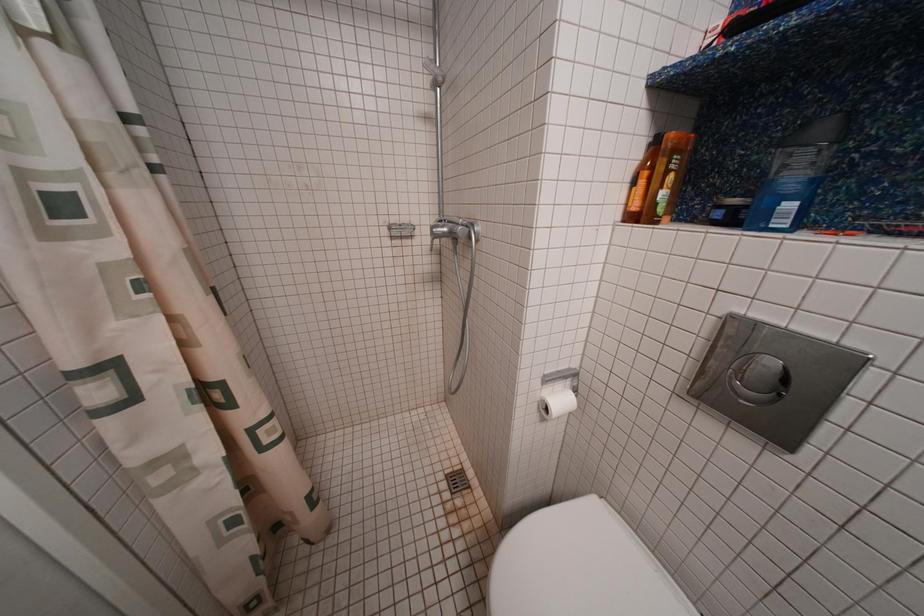
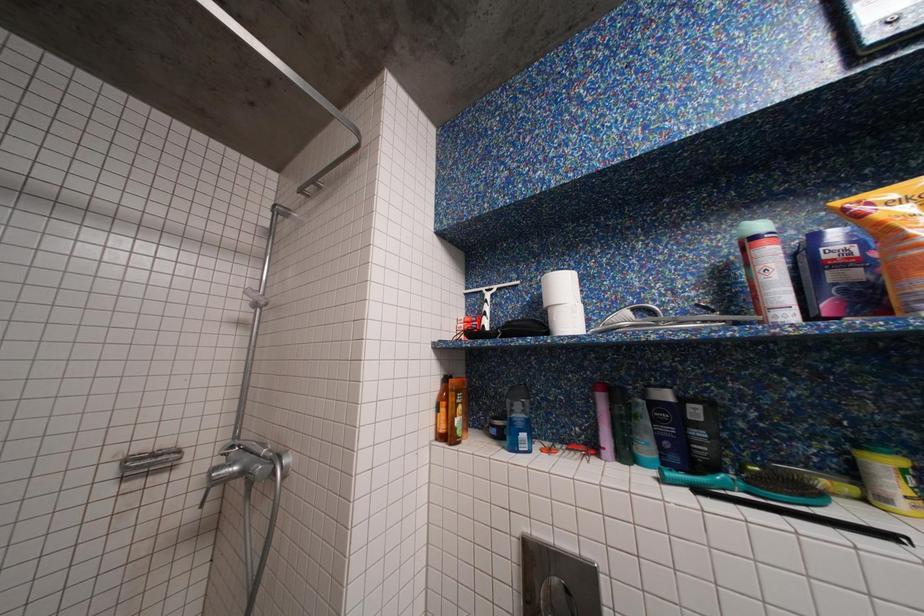
How did the camera likely rotate?

The camera rotated toward right-up.